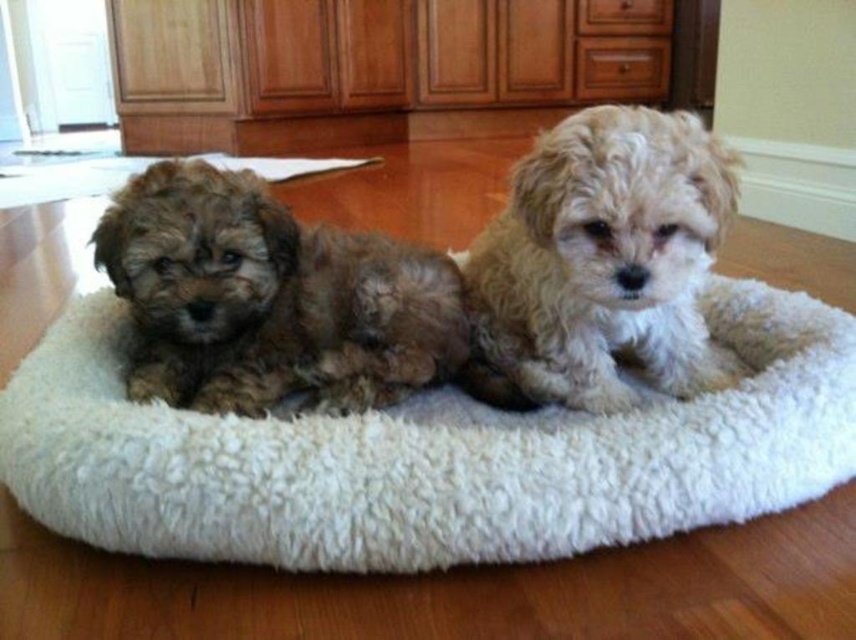
You are a dog owner who wants to ensure both puppies are comfortable in their bed. Given that the fuzzy brown dog at left is under the fuzzy beige dog at center, which puppy might be taking up more space on the bed?

The fuzzy brown dog at left is positioned under the fuzzy beige dog at center, so the fuzzy beige dog at center is likely taking up more space on the bed.